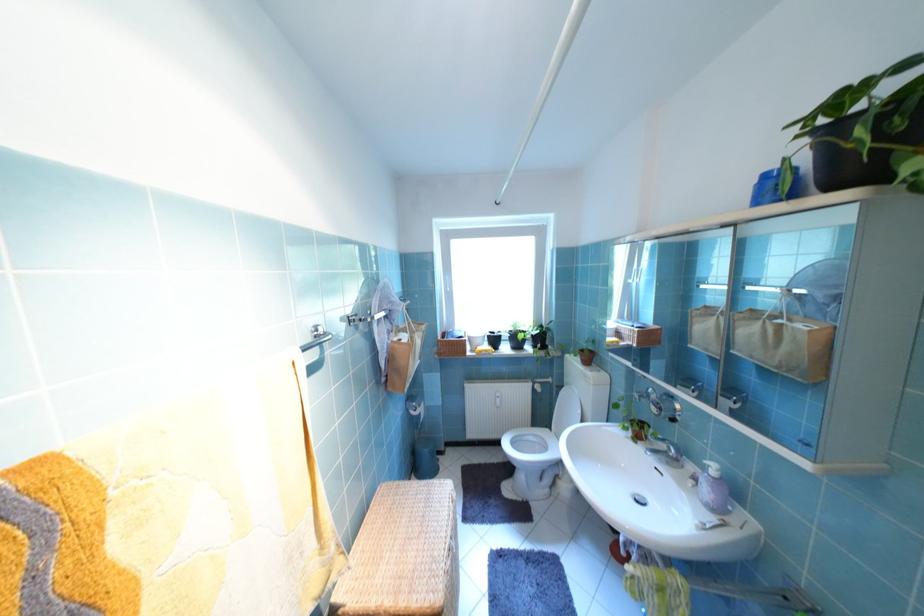
Find where to lift the small wicker basket. Please return your answer as a coordinate pair (x, y).

(451, 344)